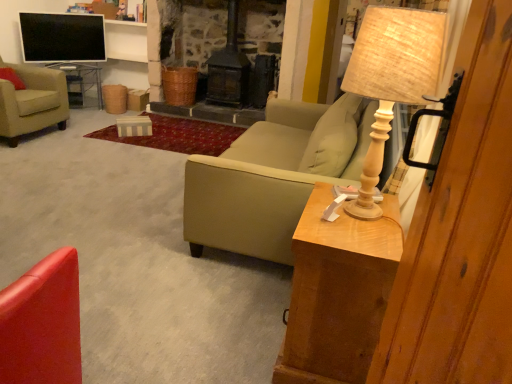
Question: In terms of size, does wooden beige table lamp at right appear bigger or smaller than shiny red chair at lower left, the first chair when ordered from bottom to top?

Choices:
 (A) small
 (B) big

Answer: (A)

Question: Is point (378, 31) positioned closer to the camera than point (29, 289)?

Choices:
 (A) farther
 (B) closer

Answer: (A)

Question: Which is farther from the wooden side table at right, positioned as the first table in right-to-left order?

Choices:
 (A) beige fabric armchair at left, which is the first chair from top to bottom
 (B) flat screen tv at upper left
 (C) wooden beige table lamp at right
 (D) suede green couch at center
 (E) shiny red chair at lower left, positioned as the second chair in back-to-front order

Answer: (B)

Question: Which object is positioned farthest from the shiny red chair at lower left, positioned as the second chair in back-to-front order?

Choices:
 (A) wooden beige table lamp at right
 (B) suede green couch at center
 (C) metal mesh table at left, the first table when ordered from back to front
 (D) beige fabric armchair at left, marked as the second chair in a right-to-left arrangement
 (E) wooden side table at right, placed as the first table when sorted from front to back

Answer: (C)